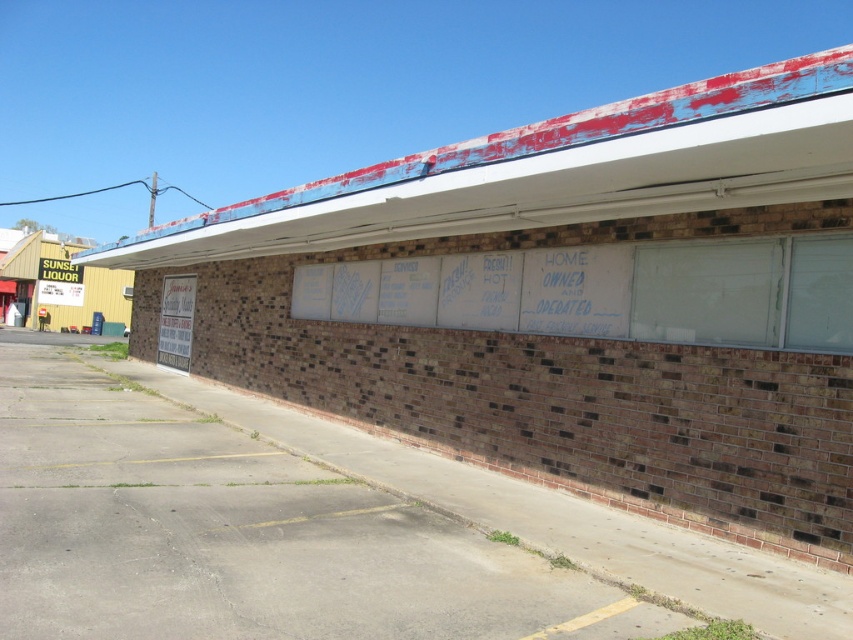
Who is lower down, white chalkboard at center or white paperboard at center?

white paperboard at center is below.

From the picture: Between white chalkboard at center and white paperboard at center, which one is positioned higher?

Positioned higher is white chalkboard at center.

Does point (590, 310) come in front of point (189, 339)?

Yes, point (590, 310) is closer to viewer.

Where is `white chalkboard at center`? white chalkboard at center is located at coordinates (477, 291).